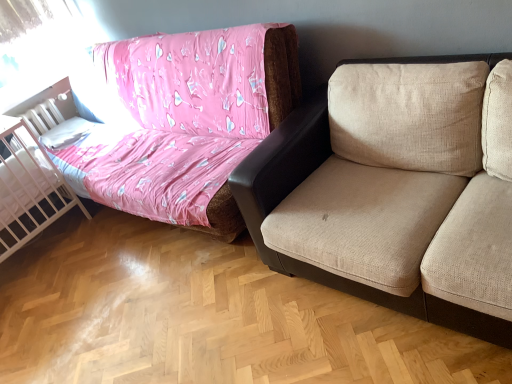
This screenshot has width=512, height=384. I want to click on vacant region in front of white mesh crib at left, so click(41, 283).